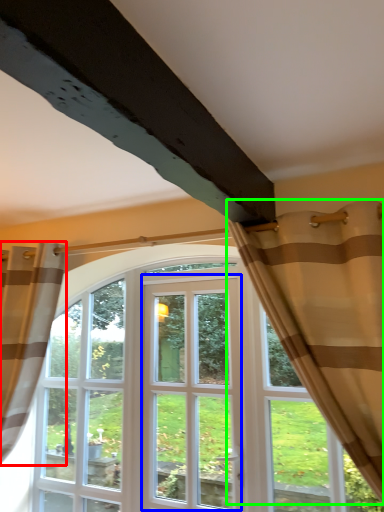
Question: Which object is the closest to the curtain (highlighted by a red box)? Choose among these: screen door (highlighted by a blue box) or curtain (highlighted by a green box).

Choices:
 (A) screen door
 (B) curtain

Answer: (A)